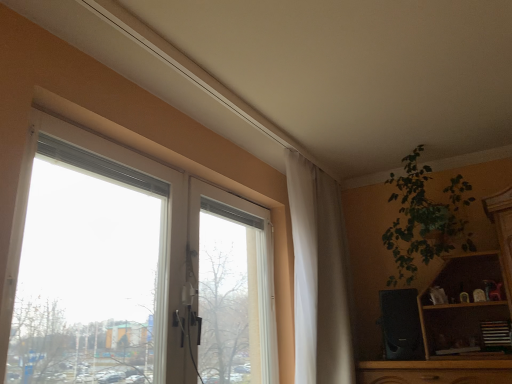
Question: In terms of width, does green leafy plant at upper right look wider or thinner when compared to white sheer curtain at center?

Choices:
 (A) wide
 (B) thin

Answer: (A)

Question: From the image's perspective, relative to white sheer curtain at center, is green leafy plant at upper right above or below?

Choices:
 (A) below
 (B) above

Answer: (B)

Question: Which of these objects is positioned closest to the white sheer curtain at center?

Choices:
 (A) transparent glass window at upper left
 (B) green leafy plant at upper right

Answer: (B)

Question: Estimate the real-world distances between objects in this image. Which object is farther from the transparent glass window at upper left?

Choices:
 (A) green leafy plant at upper right
 (B) white sheer curtain at center

Answer: (A)